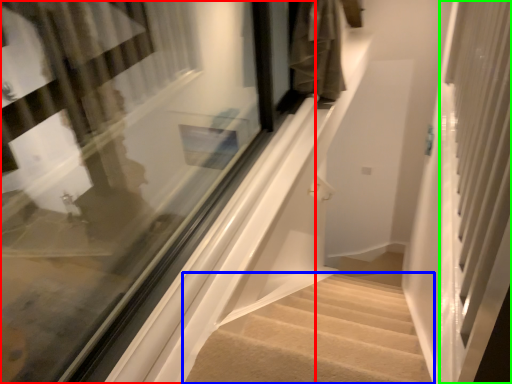
Question: Based on their relative distances, which object is farther from window (highlighted by a red box)? Choose from stairs (highlighted by a blue box) and screen door (highlighted by a green box).

Choices:
 (A) stairs
 (B) screen door

Answer: (B)